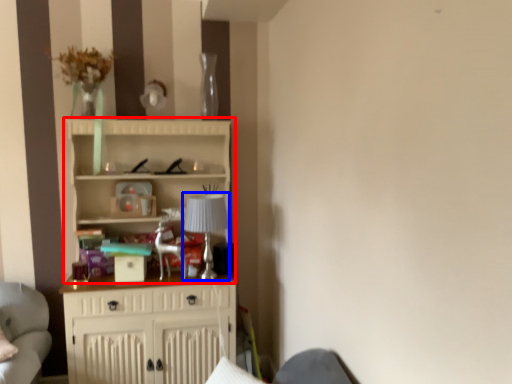
Question: Among these objects, which one is nearest to the camera, cupboard (highlighted by a red box) or lamp (highlighted by a blue box)?

Choices:
 (A) cupboard
 (B) lamp

Answer: (A)